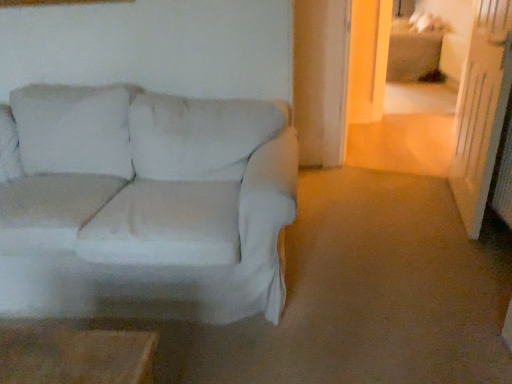
This screenshot has height=384, width=512. What do you see at coordinates (146, 205) in the screenshot?
I see `white fabric couch at left` at bounding box center [146, 205].

Where is `white fabric couch at left`? This screenshot has width=512, height=384. white fabric couch at left is located at coordinates (146, 205).

At what (x,y) coordinates should I click in order to perform the action: click on transparent glass door at right. Please return your answer as a coordinate pair (x, y). Image resolution: width=512 pixels, height=384 pixels. Looking at the image, I should click on (481, 110).

What do you see at coordinates (481, 110) in the screenshot? Image resolution: width=512 pixels, height=384 pixels. I see `transparent glass door at right` at bounding box center [481, 110].

From the picture: Measure the distance between transparent glass door at right and camera.

transparent glass door at right and camera are 6.22 feet apart from each other.

Locate an element on the screen. white fabric couch at left is located at coordinates 146,205.

Considering the relative positions of transparent glass door at right and white fabric couch at left in the image provided, is transparent glass door at right to the right of white fabric couch at left from the viewer's perspective?

Yes.

Which object is closer to the camera taking this photo, transparent glass door at right or white fabric couch at left?

white fabric couch at left is more forward.

Is point (502, 96) farther from viewer compared to point (44, 193)?

No, (502, 96) is closer to viewer.

From the image's perspective, is transparent glass door at right located above white fabric couch at left?

Yes.

From a real-world perspective, who is located higher, transparent glass door at right or white fabric couch at left?

transparent glass door at right.

Consider the image. Considering the sizes of objects transparent glass door at right and white fabric couch at left in the image provided, who is wider, transparent glass door at right or white fabric couch at left?

Wider between the two is white fabric couch at left.

Is transparent glass door at right taller than white fabric couch at left?

Indeed, transparent glass door at right has a greater height compared to white fabric couch at left.

Considering the sizes of objects transparent glass door at right and white fabric couch at left in the image provided, who is bigger, transparent glass door at right or white fabric couch at left?

With larger size is white fabric couch at left.

Would you say white fabric couch at left is part of transparent glass door at right's contents?

No, white fabric couch at left is located outside of transparent glass door at right.

Is transparent glass door at right next to white fabric couch at left?

No, transparent glass door at right is not beside white fabric couch at left.

Is transparent glass door at right aimed at white fabric couch at left?

Yes.

How many degrees apart are the facing directions of transparent glass door at right and white fabric couch at left?

99.3 degrees separate the facing orientations of transparent glass door at right and white fabric couch at left.

Where is `glass door above the white fabric couch at left (from the image's perspective)`? This screenshot has height=384, width=512. glass door above the white fabric couch at left (from the image's perspective) is located at coordinates (481, 110).

Based on the photo, can you confirm if white fabric couch at left is positioned to the left of transparent glass door at right?

Indeed, white fabric couch at left is positioned on the left side of transparent glass door at right.

Is white fabric couch at left in front of or behind transparent glass door at right in the image?

white fabric couch at left is positioned closer to the viewer than transparent glass door at right.

Does point (139, 156) lie in front of point (477, 25)?

That is True.

From the image's perspective, is white fabric couch at left above or below transparent glass door at right?

From the image's perspective, white fabric couch at left appears below transparent glass door at right.

From a real-world perspective, is white fabric couch at left above or below transparent glass door at right?

In terms of real-world spatial position, white fabric couch at left is below transparent glass door at right.

Considering the relative sizes of white fabric couch at left and transparent glass door at right in the image provided, is white fabric couch at left thinner than transparent glass door at right?

No, white fabric couch at left is not thinner than transparent glass door at right.

Between white fabric couch at left and transparent glass door at right, which one has more height?

transparent glass door at right is taller.

Is white fabric couch at left bigger or smaller than transparent glass door at right?

In the image, white fabric couch at left appears to be larger than transparent glass door at right.

Would you say white fabric couch at left is outside transparent glass door at right?

Yes.

Is the surface of white fabric couch at left in direct contact with transparent glass door at right?

No, white fabric couch at left is not touching transparent glass door at right.

Is white fabric couch at left aimed at transparent glass door at right?

No, white fabric couch at left is not oriented towards transparent glass door at right.

What's the angular difference between white fabric couch at left and transparent glass door at right's facing directions?

They differ by 99.3 degrees in their facing directions.

You are a GUI agent. You are given a task and a screenshot of the screen. Output one action in this format:
    pyautogui.click(x=<x>, y=<y>)
    Task: Click on the glass door that appears above the white fabric couch at left (from the image's perspective)
    This screenshot has width=512, height=384.
    Given the screenshot: What is the action you would take?
    click(x=481, y=110)

The width and height of the screenshot is (512, 384). Find the location of `studio couch in front of the transparent glass door at right`. studio couch in front of the transparent glass door at right is located at coordinates (146, 205).

Where is `glass door that appears above the white fabric couch at left (from a real-world perspective)`? This screenshot has height=384, width=512. glass door that appears above the white fabric couch at left (from a real-world perspective) is located at coordinates (481, 110).